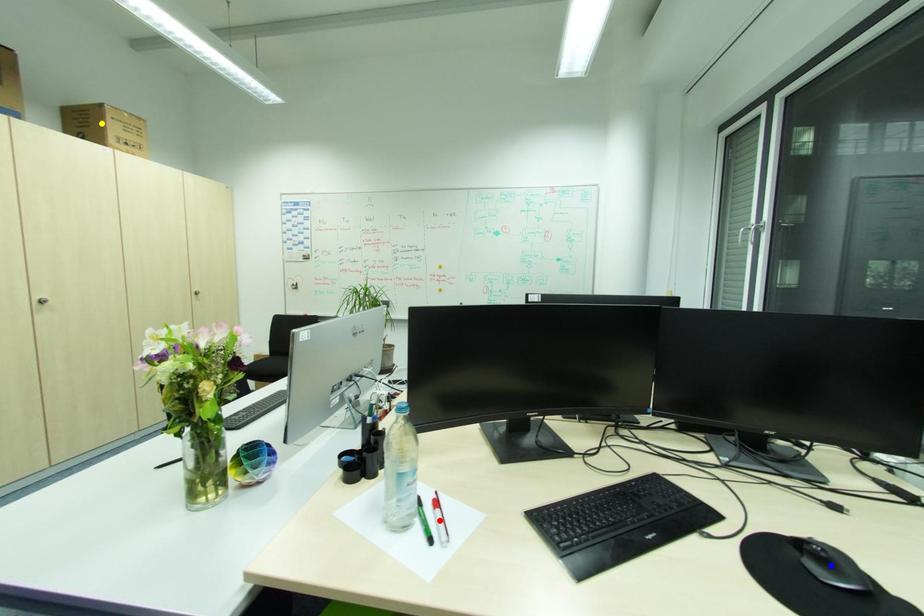
Order these from nearest to farthest:
A) yellow point
B) red point
C) blue point

yellow point → red point → blue point